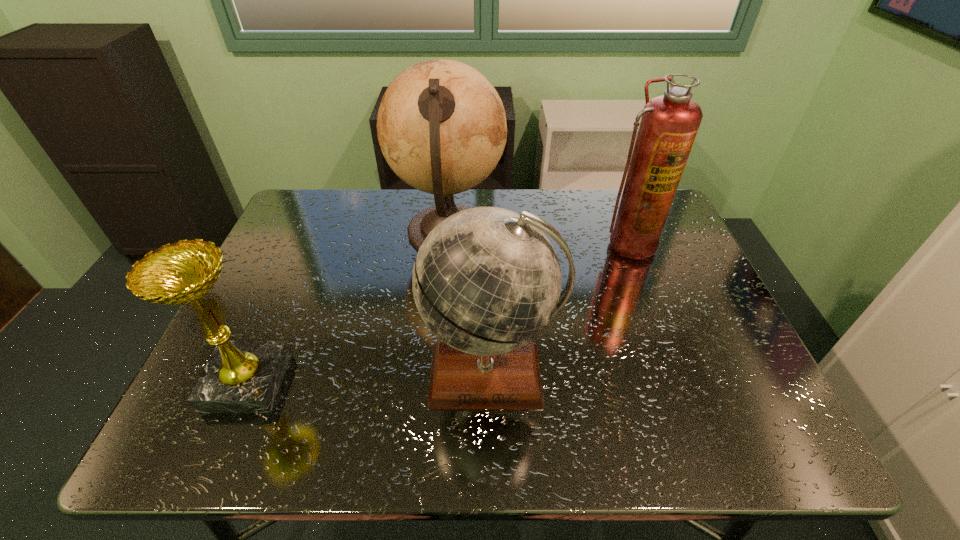
What are the coordinates of `the farther globe` in the screenshot? It's located at 441,125.

Where is `fire extinguisher`? This screenshot has height=540, width=960. fire extinguisher is located at coordinates (669, 124).

The height and width of the screenshot is (540, 960). What are the coordinates of `the nearer globe` in the screenshot? It's located at (486, 281).

In order to click on the shortest object in this screenshot , I will do `click(241, 376)`.

You are a GUI agent. You are given a task and a screenshot of the screen. Output one action in this format:
    pyautogui.click(x=<x>, y=<y>)
    Task: Click on the award
    The width and height of the screenshot is (960, 540).
    Given the screenshot: What is the action you would take?
    pyautogui.click(x=241, y=376)

Image resolution: width=960 pixels, height=540 pixels. Find the location of `free space located 0.360m on the front-facing side of the farther globe`. free space located 0.360m on the front-facing side of the farther globe is located at coordinates (629, 232).

This screenshot has height=540, width=960. Identify the location of vacant area situated 0.280m on the side of the rightmost object with the label. (666, 347).

Where is `vacant position located on the front-facing side of the shortest object`? vacant position located on the front-facing side of the shortest object is located at coordinates (335, 382).

Locate an element on the screen. globe that is at the far edge is located at coordinates (441, 125).

Image resolution: width=960 pixels, height=540 pixels. In order to click on fire extinguisher at the far edge in this screenshot , I will do `click(669, 124)`.